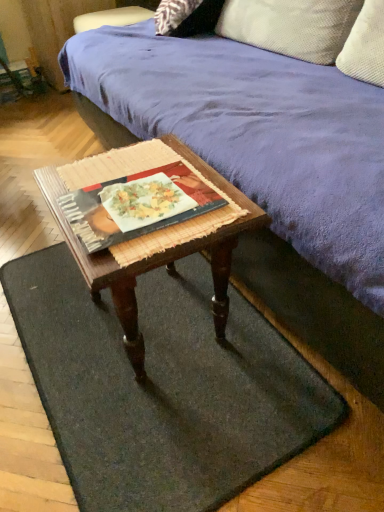
Question: From the image's perspective, is matte black book at center over green felt doormat at lower center?

Choices:
 (A) no
 (B) yes

Answer: (B)

Question: Is matte black book at center outside of green felt doormat at lower center?

Choices:
 (A) no
 (B) yes

Answer: (B)

Question: Is green felt doormat at lower center completely or partially inside matte black book at center?

Choices:
 (A) yes
 (B) no

Answer: (B)

Question: Is matte black book at center looking in the opposite direction of green felt doormat at lower center?

Choices:
 (A) no
 (B) yes

Answer: (A)

Question: Is matte black book at center next to green felt doormat at lower center?

Choices:
 (A) yes
 (B) no

Answer: (B)

Question: From a real-world perspective, is woven wood coffee table at center physically located above or below textured beige pillow at upper right?

Choices:
 (A) below
 (B) above

Answer: (A)

Question: Is woven wood coffee table at center wider or thinner than textured beige pillow at upper right?

Choices:
 (A) wide
 (B) thin

Answer: (A)

Question: From the image's perspective, is woven wood coffee table at center located above or below textured beige pillow at upper right?

Choices:
 (A) above
 (B) below

Answer: (B)

Question: Considering the positions of woven wood coffee table at center and textured beige pillow at upper right in the image, is woven wood coffee table at center taller or shorter than textured beige pillow at upper right?

Choices:
 (A) short
 (B) tall

Answer: (B)

Question: Is purple suede couch at upper center in front of or behind green felt doormat at lower center in the image?

Choices:
 (A) behind
 (B) front

Answer: (B)

Question: Looking at their shapes, would you say purple suede couch at upper center is wider or thinner than green felt doormat at lower center?

Choices:
 (A) wide
 (B) thin

Answer: (A)

Question: Is purple suede couch at upper center situated inside green felt doormat at lower center or outside?

Choices:
 (A) outside
 (B) inside

Answer: (A)

Question: From the image's perspective, is purple suede couch at upper center positioned above or below green felt doormat at lower center?

Choices:
 (A) below
 (B) above

Answer: (B)

Question: From a real-world perspective, relative to matte black book at center, is purple suede couch at upper center vertically above or below?

Choices:
 (A) below
 (B) above

Answer: (A)

Question: From the image's perspective, relative to matte black book at center, is purple suede couch at upper center above or below?

Choices:
 (A) below
 (B) above

Answer: (B)